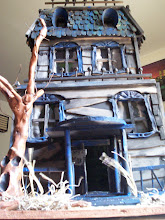
The height and width of the screenshot is (220, 165). I want to click on rod, so click(49, 3).